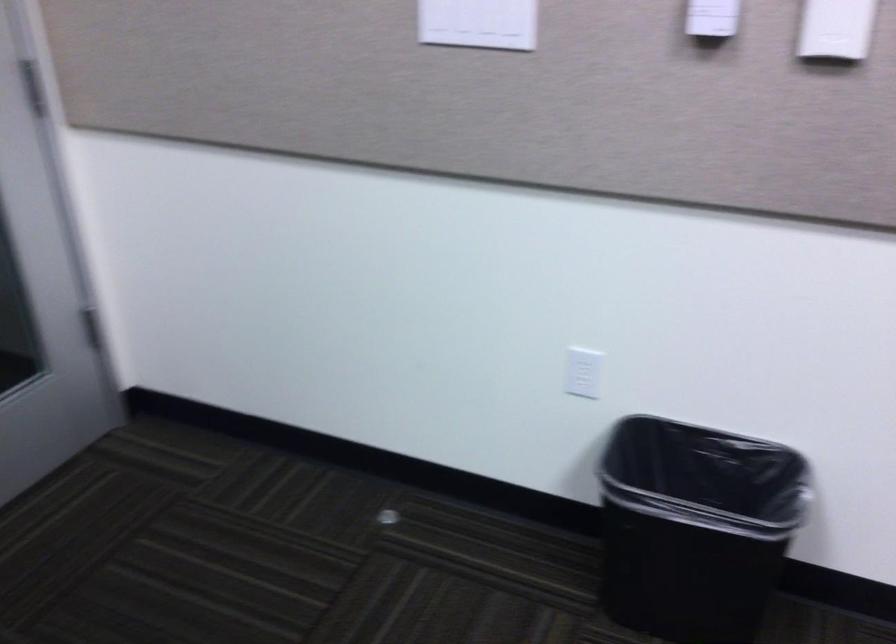
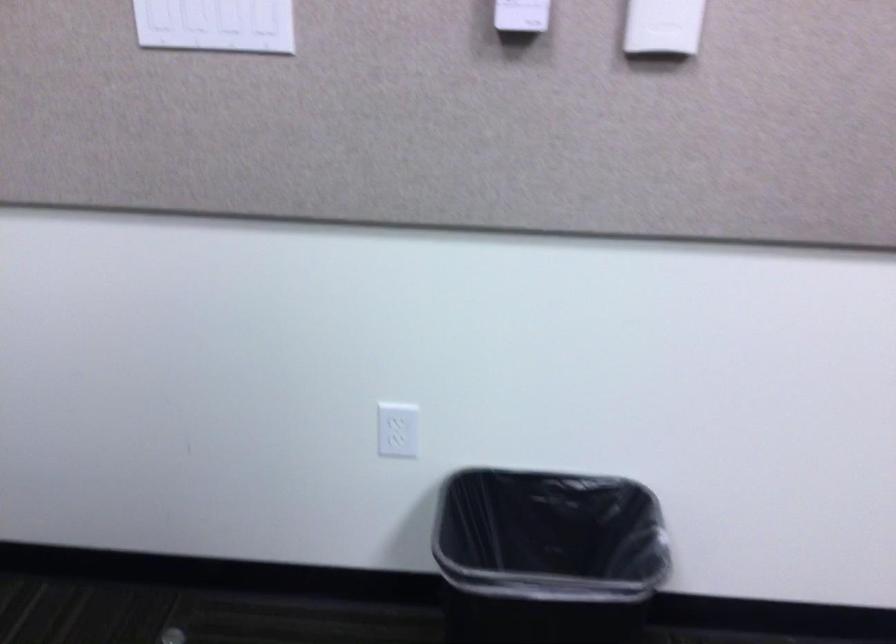
The point at (582, 371) is marked in the first image. Where is the corresponding point in the second image?

(398, 430)